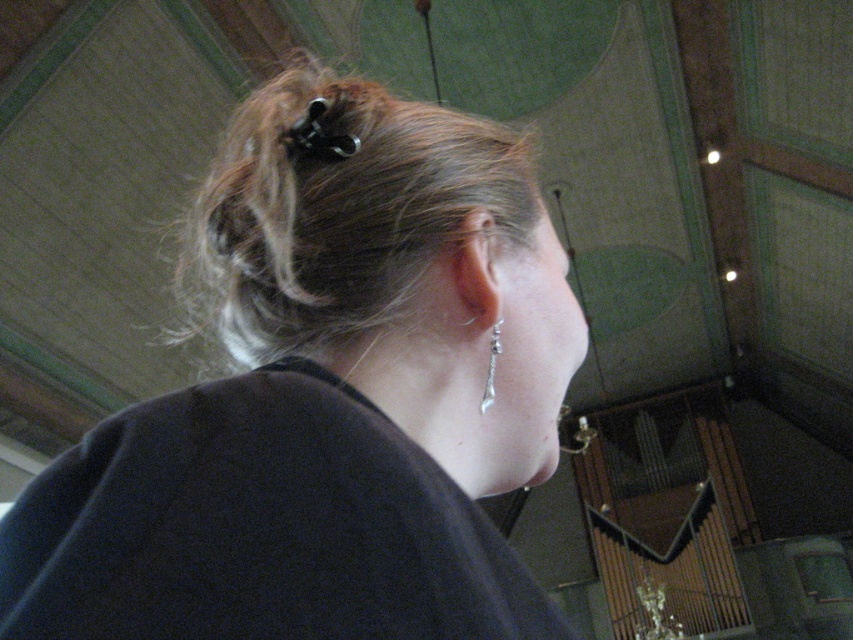
You are an artist sketching this scene. You need to locate the matte black hair at center. Where would you look on the canvas?

The matte black hair at center is located at point (326, 396) on the canvas.

You are standing in the room and want to determine which of the two points, point (431, 417) or point (292, 316), is closer to you. Based on the scene, can you identify the closer point?

Point (431, 417) is closer to the viewer than point (292, 316).

You are standing in the room and want to determine which of the two points, point (276, 212) or point (482, 403), is nearer to you. Based on the image, which point is closer?

Point (276, 212) is closer to the camera than point (482, 403), so it is the nearer point.